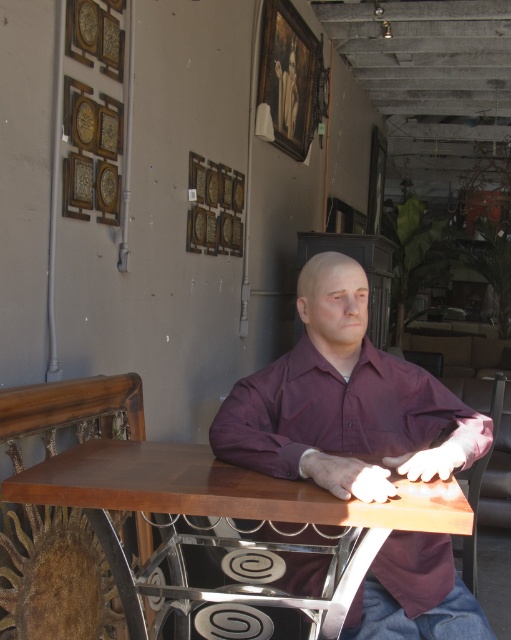
Question: Observing the image, what is the correct spatial positioning of wooden textured chair at left in reference to wooden picture frame at upper left?

Choices:
 (A) left
 (B) right

Answer: (B)

Question: Can you confirm if matte purple shirt at center is positioned above wooden table at center?

Choices:
 (A) yes
 (B) no

Answer: (A)

Question: Which point is farther to the camera?

Choices:
 (A) wooden picture frame at upper center
 (B) wooden table at center
 (C) brown leather chair at lower right
 (D) wooden picture frame at upper left

Answer: (A)

Question: Can you confirm if wooden picture frame at upper center is positioned to the right of wooden picture frame at upper left?

Choices:
 (A) no
 (B) yes

Answer: (B)

Question: Which object is positioned farthest from the wooden table at center?

Choices:
 (A) matte purple shirt at center
 (B) brown leather chair at lower right

Answer: (B)

Question: Which point appears closest to the camera in this image?

Choices:
 (A) (317, 44)
 (B) (216, 468)
 (C) (83, 184)
 (D) (401, 579)

Answer: (B)